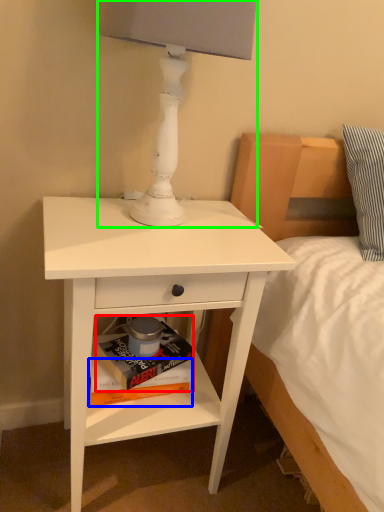
Question: Which object is the closest to the paperback book (highlighted by a red box)? Choose among these: paperback book (highlighted by a blue box) or table lamp (highlighted by a green box).

Choices:
 (A) paperback book
 (B) table lamp

Answer: (A)